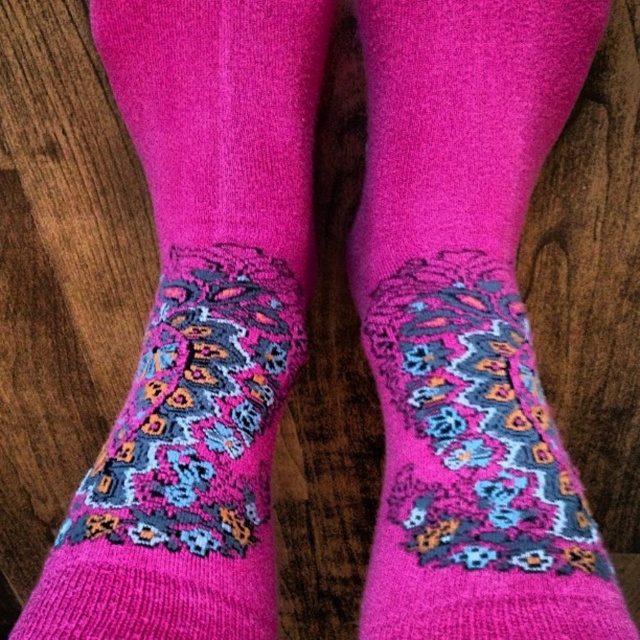
Which is in front, point (401, 342) or point (150, 442)?

Point (150, 442) is in front.

Is pink knitted socks at center to the left of knitted pink socks at center from the viewer's perspective?

In fact, pink knitted socks at center is to the right of knitted pink socks at center.

Who is more distant from viewer, (x=420, y=468) or (x=244, y=406)?

The point (x=244, y=406) is more distant.

At what (x,y) coordinates should I click in order to perform the action: click on pink knitted socks at center. Please return your answer as a coordinate pair (x, y). Looking at the image, I should click on (474, 472).